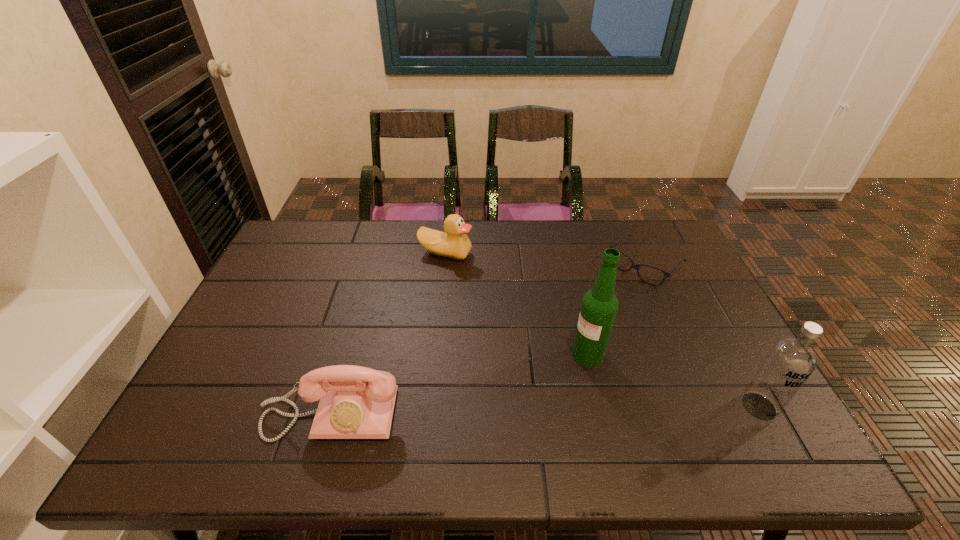
Find the location of a particular element. The width and height of the screenshot is (960, 540). vacant space on the desktop that is between the telephone and the fourth shortest object and is positioned at the beak of the duck is located at coordinates (553, 410).

Locate an element on the screen. free space on the desktop that is between the telephone and the vodka and is positioned on the front-facing side of the shortest object is located at coordinates (492, 411).

I want to click on free space on the desktop that is between the telephone and the fourth shortest object and is positioned on the label of the third object from left to right, so click(x=523, y=410).